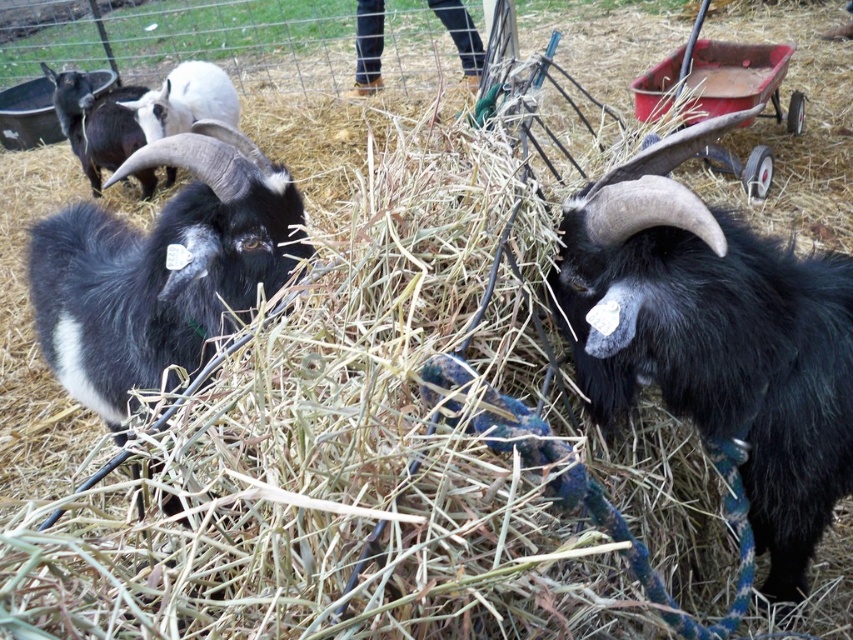
Question: Can you confirm if black woolen goat at left is positioned to the right of black woolen goat at upper left?

Choices:
 (A) no
 (B) yes

Answer: (B)

Question: Considering the relative positions of red metal cart at upper right and white woolen sheep at upper left in the image provided, where is red metal cart at upper right located with respect to white woolen sheep at upper left?

Choices:
 (A) below
 (B) above

Answer: (A)

Question: Which point appears closest to the camera in this image?

Choices:
 (A) (94, 108)
 (B) (138, 349)

Answer: (B)

Question: Which object is the closest to the black woolen goat at upper left?

Choices:
 (A) black woolen goat at center
 (B) black woolen goat at left

Answer: (B)

Question: Is black woolen goat at center below black woolen goat at upper left?

Choices:
 (A) yes
 (B) no

Answer: (A)

Question: Which point appears closest to the camera in this image?

Choices:
 (A) (144, 198)
 (B) (599, 339)
 (C) (218, 115)

Answer: (B)